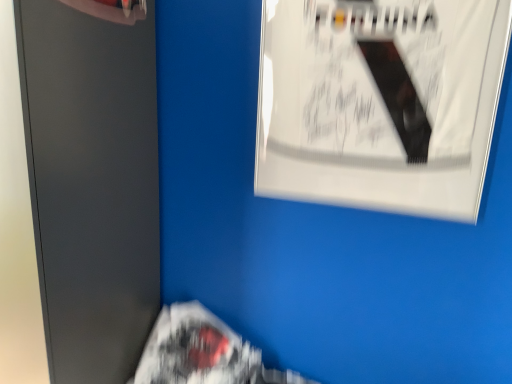
Question: Is point (133, 354) positioned closer to the camera than point (437, 196)?

Choices:
 (A) farther
 (B) closer

Answer: (A)

Question: Is matte gray file cabinet at left to the left or to the right of white glossy poster at upper right in the image?

Choices:
 (A) right
 (B) left

Answer: (B)

Question: Based on their relative distances, which object is farther from the white glossy poster at upper right?

Choices:
 (A) matte gray file cabinet at left
 (B) white paper flyer at lower center

Answer: (B)

Question: Which of these objects is positioned farthest from the white paper flyer at lower center?

Choices:
 (A) matte gray file cabinet at left
 (B) white glossy poster at upper right

Answer: (B)